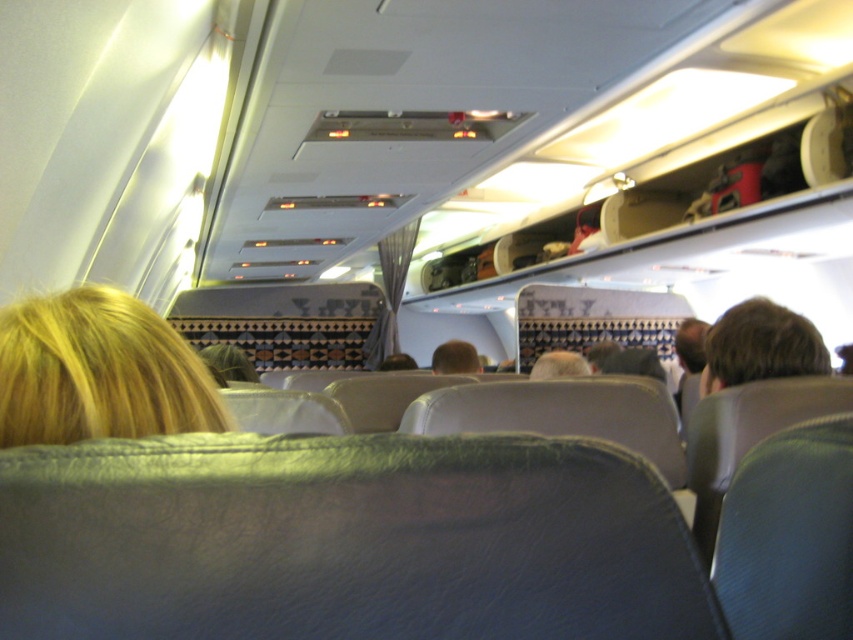
Between blonde hair at upper left and blonde hair at center, which one is positioned higher?

blonde hair at upper left is higher up.

Can you confirm if blonde hair at upper left is taller than blonde hair at center?

Correct, blonde hair at upper left is much taller as blonde hair at center.

Between point (106, 428) and point (469, 358), which one is positioned behind?

Positioned behind is point (469, 358).

Identify the location of blonde hair at upper left. (97, 371).

Is blonde hair at upper left above brown hair at right?

Indeed, blonde hair at upper left is positioned over brown hair at right.

Which of these two, blonde hair at upper left or brown hair at right, stands shorter?

blonde hair at upper left

Does point (18, 307) come in front of point (741, 308)?

Yes.

At what (x,y) coordinates should I click in order to perform the action: click on blonde hair at upper left. Please return your answer as a coordinate pair (x, y). Looking at the image, I should click on (97, 371).

Can you confirm if brown hair at right is wider than blonde hair at center?

Incorrect, brown hair at right's width does not surpass blonde hair at center's.

Is brown hair at right to the left of blonde hair at center from the viewer's perspective?

Incorrect, brown hair at right is not on the left side of blonde hair at center.

Is point (769, 353) positioned in front of point (438, 358)?

Yes.

At what (x,y) coordinates should I click in order to perform the action: click on brown hair at right. Please return your answer as a coordinate pair (x, y). This screenshot has width=853, height=640. Looking at the image, I should click on 759,346.